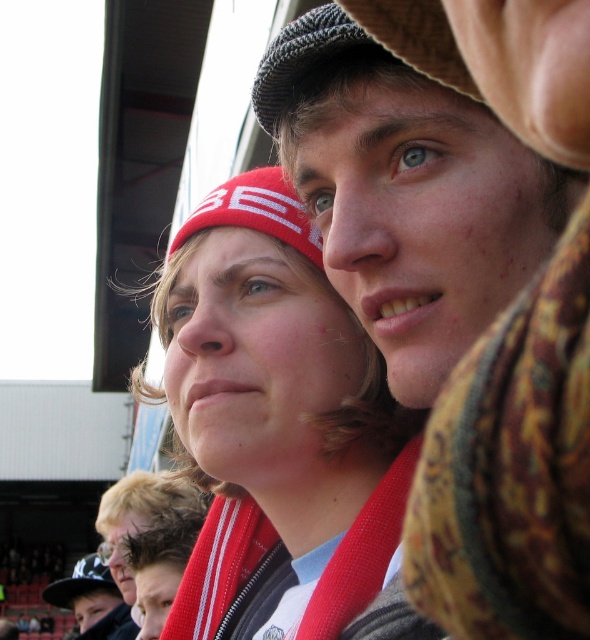
Does red fabric scarf at center lie behind knitted gray cap at upper center?

Yes, red fabric scarf at center is behind knitted gray cap at upper center.

Who is positioned more to the right, red fabric scarf at center or knitted gray cap at upper center?

From the viewer's perspective, knitted gray cap at upper center appears more on the right side.

Does point (258, 602) come behind point (268, 125)?

Yes, it is.

You are a GUI agent. You are given a task and a screenshot of the screen. Output one action in this format:
    pyautogui.click(x=<x>, y=<y>)
    Task: Click on the red fabric scarf at center
    The height and width of the screenshot is (640, 590).
    Given the screenshot: What is the action you would take?
    pyautogui.click(x=276, y=416)

Does knitted gray cap at upper center appear over black fabric baseball cap at lower left?

Correct, knitted gray cap at upper center is located above black fabric baseball cap at lower left.

Which is more to the right, knitted gray cap at upper center or black fabric baseball cap at lower left?

From the viewer's perspective, knitted gray cap at upper center appears more on the right side.

Is point (296, 86) less distant than point (76, 584)?

Yes.

The width and height of the screenshot is (590, 640). What are the coordinates of `knitted gray cap at upper center` in the screenshot? It's located at (303, 61).

Is the position of red fabric scarf at center more distant than that of black fabric baseball cap at lower left?

No, red fabric scarf at center is in front of black fabric baseball cap at lower left.

Can you confirm if red fabric scarf at center is positioned to the right of black fabric baseball cap at lower left?

Yes, red fabric scarf at center is to the right of black fabric baseball cap at lower left.

Is point (238, 484) farther from viewer compared to point (73, 572)?

No, (238, 484) is closer to viewer.

The height and width of the screenshot is (640, 590). I want to click on red fabric scarf at center, so click(276, 416).